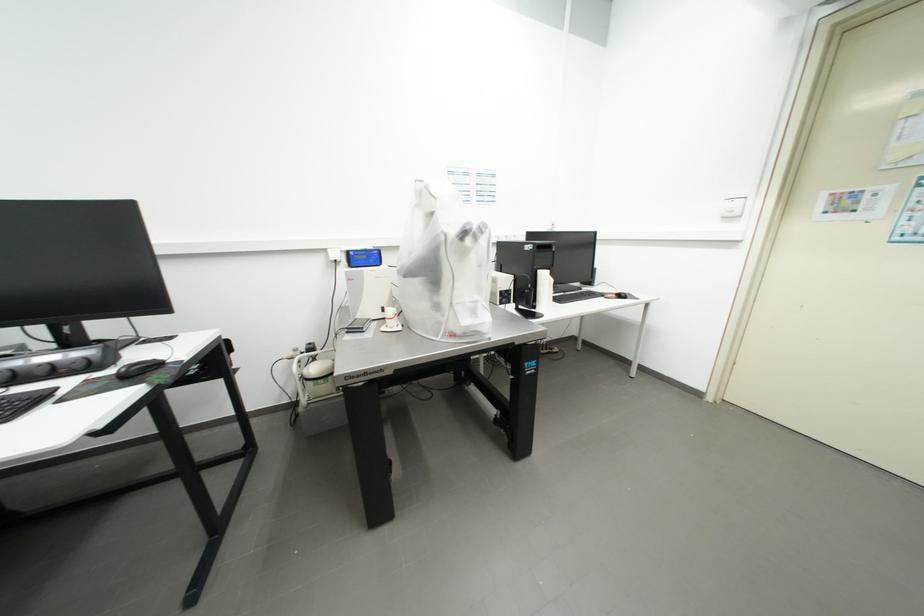
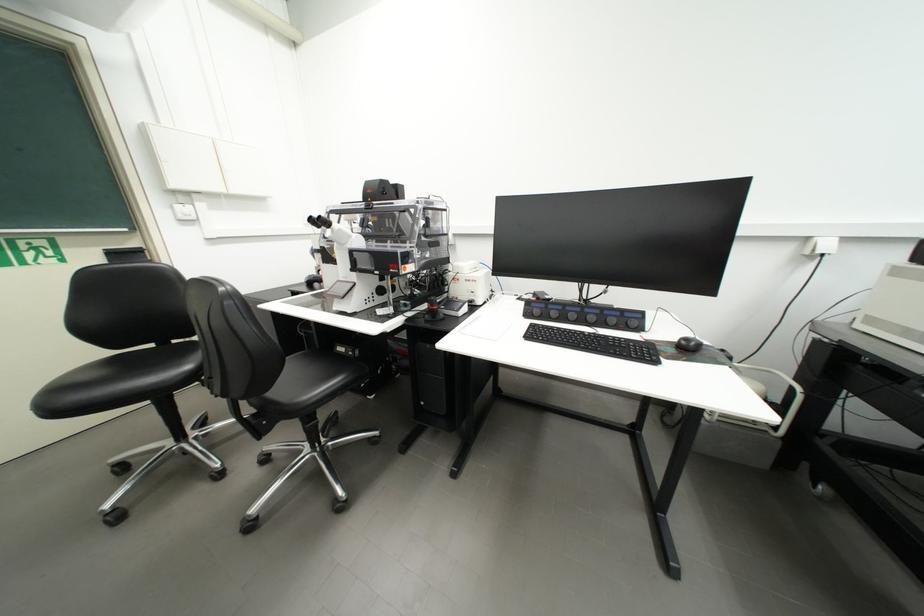
Locate, in the second image, the point that corresponds to (148,376) in the first image.

(697, 351)